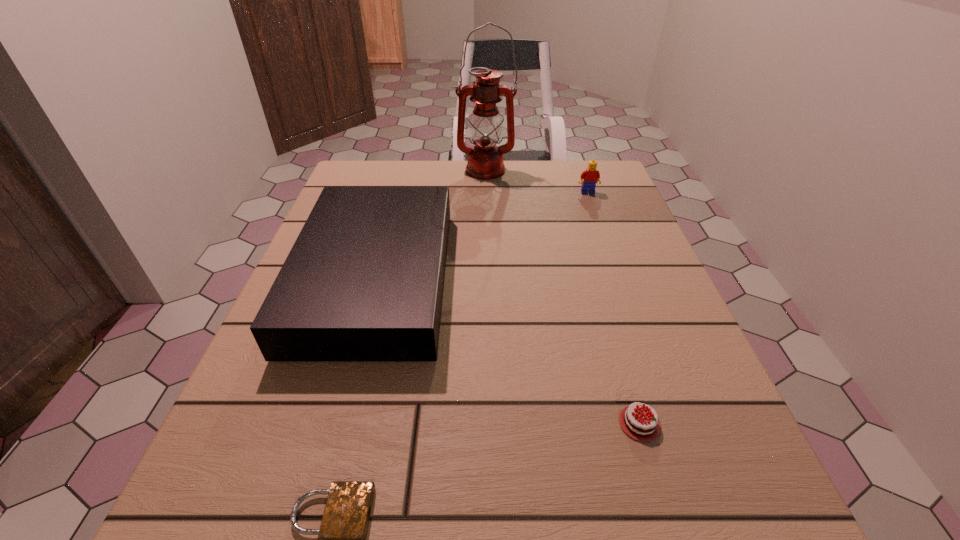
The height and width of the screenshot is (540, 960). What are the coordinates of `free space at the far left corner` in the screenshot? It's located at (399, 186).

Identify the location of free location at the near left corner of the desktop. (212, 491).

You are a GUI agent. You are given a task and a screenshot of the screen. Output one action in this format:
    pyautogui.click(x=<x>, y=<y>)
    Task: Click on the free space between the oil lamp and the fourth tallest object
    Image resolution: width=960 pixels, height=540 pixels.
    Given the screenshot: What is the action you would take?
    pyautogui.click(x=562, y=297)

The width and height of the screenshot is (960, 540). I want to click on unoccupied position between the CD player and the fourth tallest object, so click(x=508, y=351).

Find the location of a particular element. The height and width of the screenshot is (540, 960). vacant space in between the second shortest object and the third object from left to right is located at coordinates (562, 297).

The width and height of the screenshot is (960, 540). Find the location of `vacant area that lies between the third object from left to right and the Lego`. vacant area that lies between the third object from left to right and the Lego is located at coordinates (536, 181).

Where is `vacant area that lies between the second farthest object and the CD player`? vacant area that lies between the second farthest object and the CD player is located at coordinates click(x=482, y=235).

Identify the location of empty space that is in between the chocolate cake and the CD player. (508, 351).

Identify the location of the closest object relative to the third object from right to left. This screenshot has height=540, width=960. (591, 176).

Identify which object is located as the nearest to the shortest object. Please provide its 2D coordinates. Your answer should be formatted as a tuple, i.e. [(x, y)], where the tuple contains the x and y coordinates of a point satisfying the conditions above.

[(364, 280)]